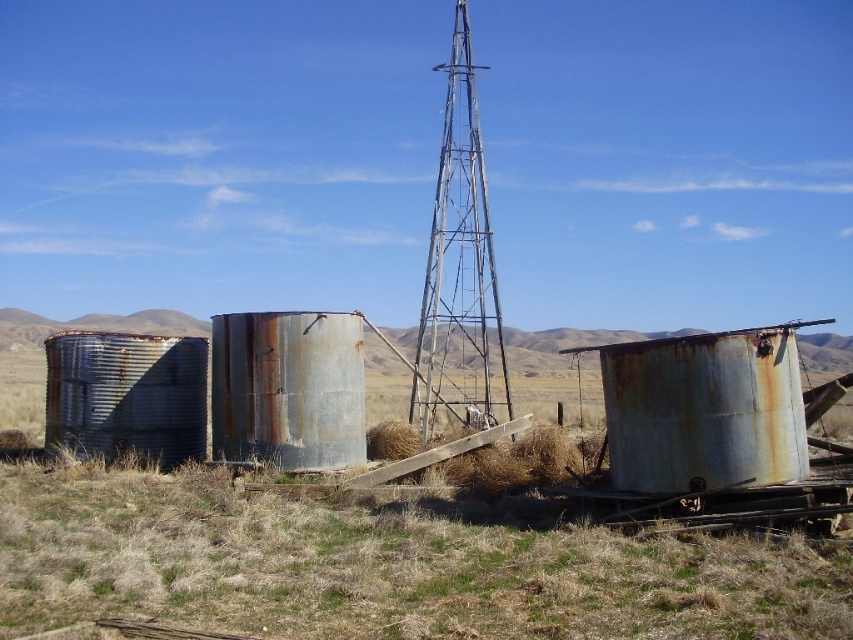
How much distance is there between rusty metal water tower at center and rusty metal silo at center?

rusty metal water tower at center is 19.48 feet from rusty metal silo at center.

Which is behind, point (434, 346) or point (321, 396)?

Point (434, 346)

Identify the location of rusty metal water tower at center. This screenshot has width=853, height=640. (459, 268).

Does dry grass at center come behind rusty metal water tower at center?

No, it is in front of rusty metal water tower at center.

Can you confirm if dry grass at center is wider than rusty metal water tower at center?

Yes, dry grass at center is wider than rusty metal water tower at center.

Which is in front, point (91, 496) or point (419, 314)?

Positioned in front is point (91, 496).

You are a GUI agent. You are given a task and a screenshot of the screen. Output one action in this format:
    pyautogui.click(x=<x>, y=<y>)
    Task: Click on the dry grass at center
    The width and height of the screenshot is (853, 640).
    Given the screenshot: What is the action you would take?
    pyautogui.click(x=386, y=566)

Can you confirm if dry grass at center is wider than rusty metal silo at center?

Yes, dry grass at center is wider than rusty metal silo at center.

Is dry grass at center to the right of rusty metal silo at center from the viewer's perspective?

Indeed, dry grass at center is positioned on the right side of rusty metal silo at center.

You are a GUI agent. You are given a task and a screenshot of the screen. Output one action in this format:
    pyautogui.click(x=<x>, y=<y>)
    Task: Click on the dry grass at center
    
    Given the screenshot: What is the action you would take?
    pyautogui.click(x=386, y=566)

The image size is (853, 640). I want to click on dry grass at center, so click(386, 566).